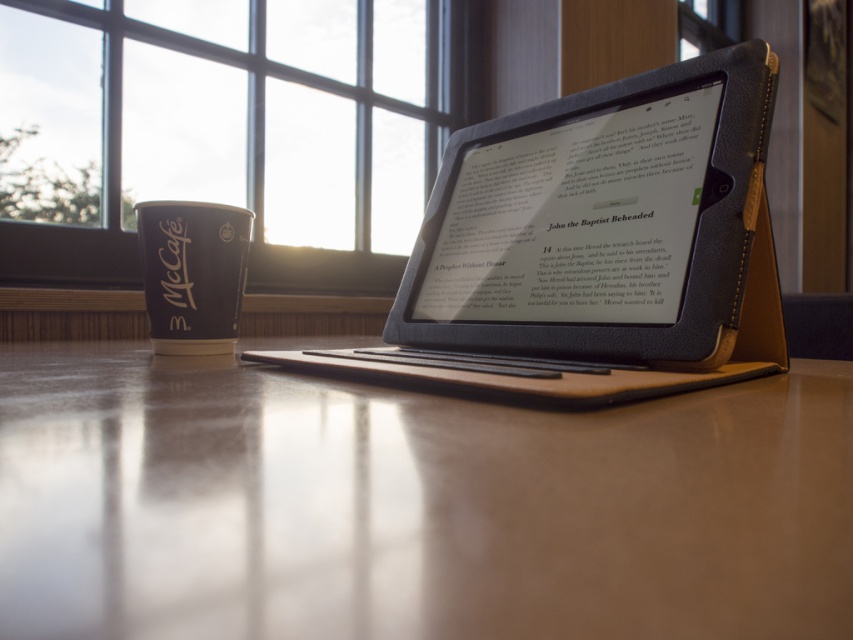
Question: Which of the following is the farthest from the observer?

Choices:
 (A) leather-bound tablet at center
 (B) smooth wooden table at center
 (C) black paper cup at left

Answer: (C)

Question: In this image, where is clear glass window at upper center located relative to black paper cup at left?

Choices:
 (A) above
 (B) below

Answer: (A)

Question: Is smooth wooden table at center wider than leather-bound tablet at center?

Choices:
 (A) yes
 (B) no

Answer: (A)

Question: Does smooth wooden table at center lie in front of leather-bound tablet at center?

Choices:
 (A) no
 (B) yes

Answer: (B)

Question: Which point is closer to the camera?

Choices:
 (A) clear glass window at upper center
 (B) black paper cup at left
 (C) leather-bound tablet at center
 (D) smooth wooden table at center

Answer: (D)

Question: Which of these objects is positioned closest to the clear glass window at upper center?

Choices:
 (A) leather-bound tablet at center
 (B) smooth wooden table at center

Answer: (A)